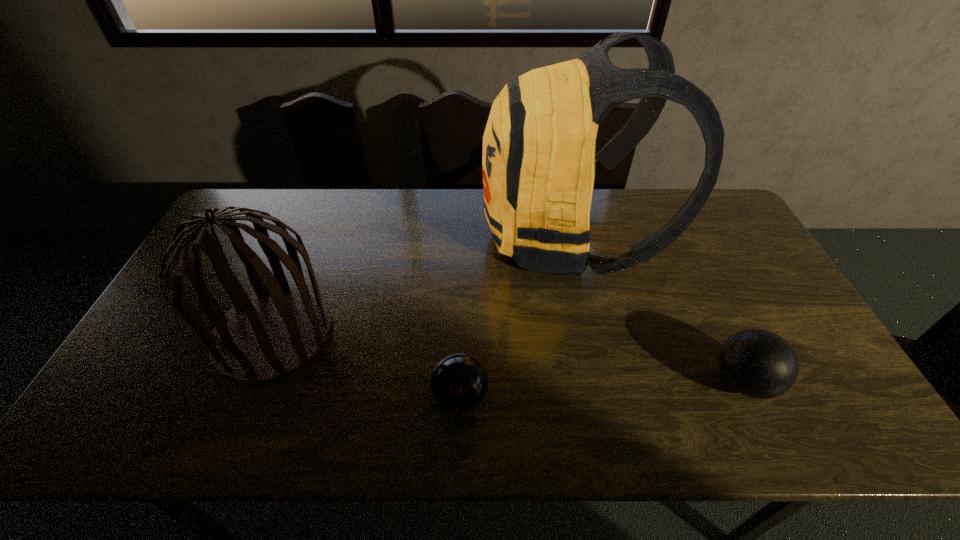
Where is `blank space at the right edge of the desktop`? This screenshot has height=540, width=960. blank space at the right edge of the desktop is located at coordinates (810, 406).

Identify the location of vacant space in between the backpack and the shorter bowling ball. (514, 318).

This screenshot has height=540, width=960. Identify the location of empty space that is in between the backpack and the right bowling ball. (655, 310).

This screenshot has height=540, width=960. Identify the location of vacant space in between the shortest object and the taller bowling ball. (602, 389).

At what (x,y) coordinates should I click in order to perform the action: click on empty location between the second shortest object and the second tallest object. Please return your answer as a coordinate pair (x, y). Looking at the image, I should click on (508, 358).

Image resolution: width=960 pixels, height=540 pixels. I want to click on empty location between the leftmost object and the backpack, so click(x=420, y=286).

Image resolution: width=960 pixels, height=540 pixels. What are the coordinates of `unoccupied position between the taller bowling ball and the shorter bowling ball` in the screenshot? It's located at (602, 389).

I want to click on free space between the backpack and the right bowling ball, so click(655, 310).

Find the location of `blank region between the leftmost object and the shorter bowling ball`. blank region between the leftmost object and the shorter bowling ball is located at coordinates (367, 366).

You are a GUI agent. You are given a task and a screenshot of the screen. Output one action in this format:
    pyautogui.click(x=<x>, y=<y>)
    Task: Click on the free space between the left bowling ball and the tallest object
    This screenshot has height=540, width=960.
    Given the screenshot: What is the action you would take?
    pyautogui.click(x=514, y=318)